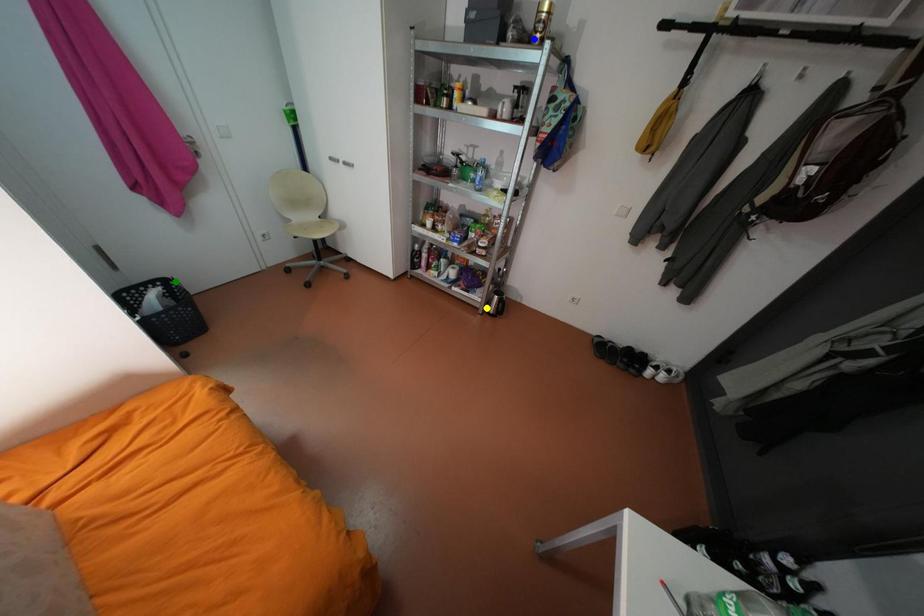
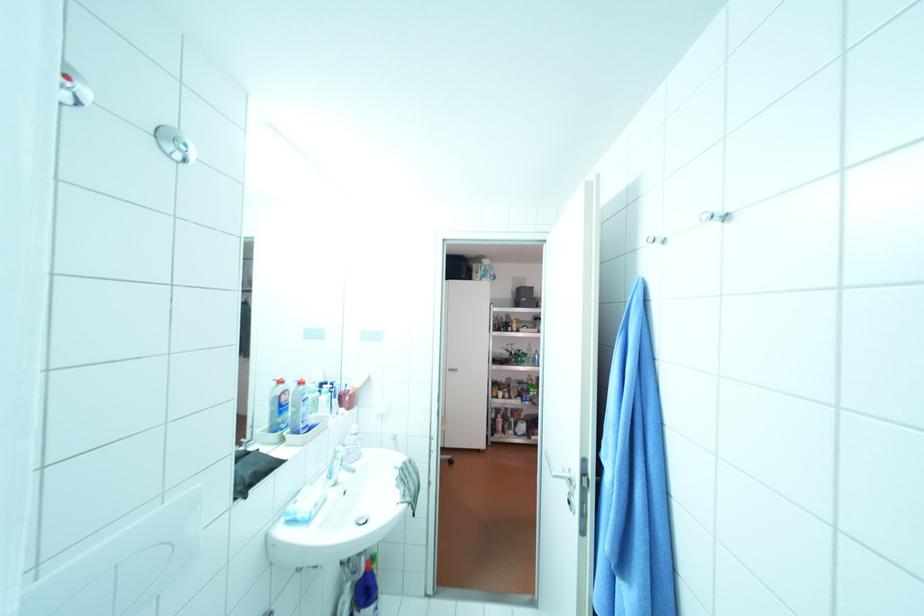
I am providing you with two images of the same scene from different viewpoints. Three points are marked in image1. Which point corresponds to a part or object that is occluded in image2?In image1, three points are marked. Which of them correspond to a part or object that is occluded in image2?Among the three points shown in image1, which one corresponds to a part or object that is no longer visible due to occlusion in image2?

green point, yellow point, blue point